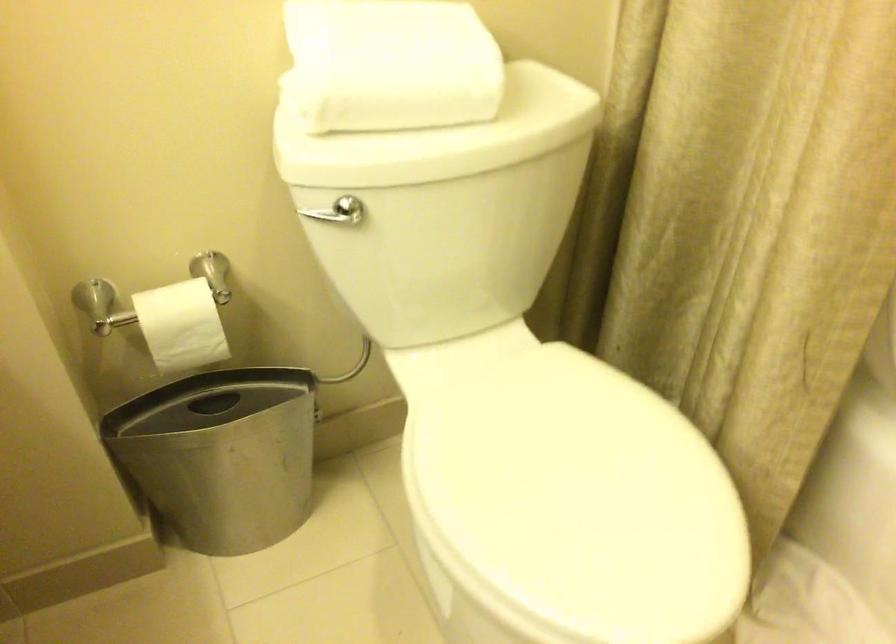
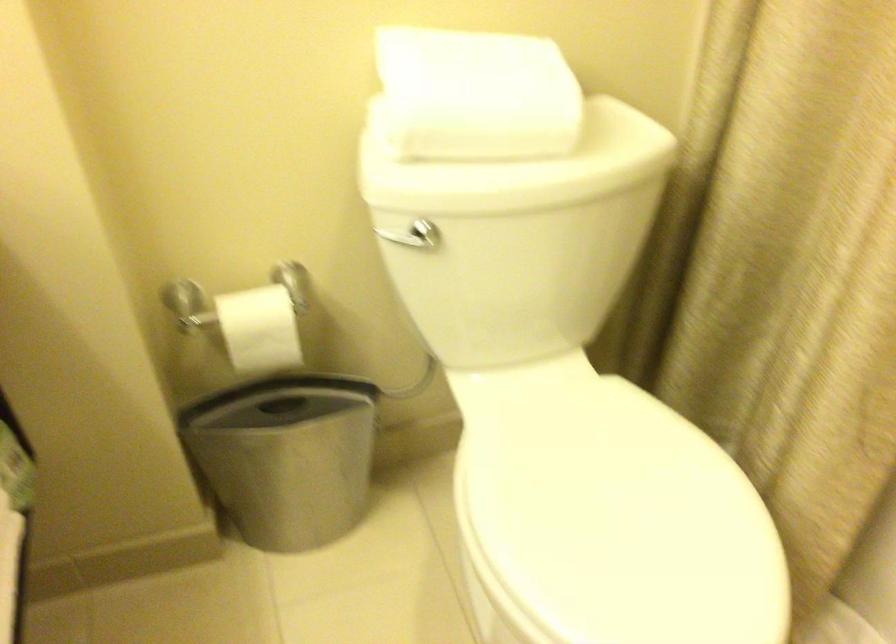
Locate, in the second image, the point that corresponds to (569,488) in the first image.

(613, 518)